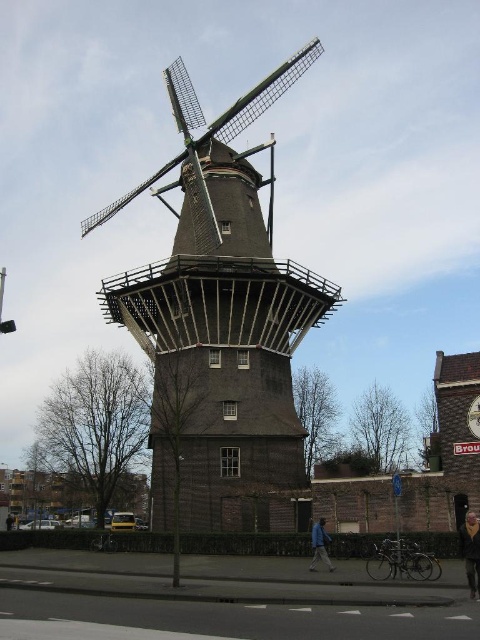
Question: Does dark brown wooden windmill at center appear over dark brown leather jacket at lower right?

Choices:
 (A) no
 (B) yes

Answer: (B)

Question: Can you confirm if dark brown wooden windmill at center is positioned to the left of dark brown leather jacket at lower right?

Choices:
 (A) yes
 (B) no

Answer: (A)

Question: Estimate the real-world distances between objects in this image. Which object is farther from the blue fabric jacket at lower center?

Choices:
 (A) dark brown leather jacket at lower right
 (B) dark brown wooden windmill at center

Answer: (B)

Question: Is dark brown leather jacket at lower right below blue fabric jacket at lower center?

Choices:
 (A) yes
 (B) no

Answer: (B)

Question: Which of the following is the farthest from the observer?

Choices:
 (A) (314, 540)
 (B) (479, 598)

Answer: (A)

Question: Which of the following is the closest to the observer?

Choices:
 (A) dark brown wooden windmill at center
 (B) dark brown leather jacket at lower right

Answer: (B)